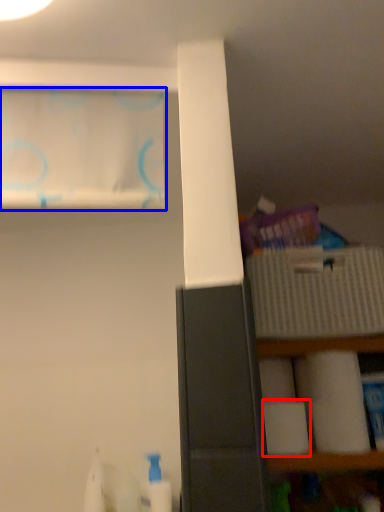
Question: Which object is further to the camera taking this photo, toilet paper (highlighted by a red box) or curtain (highlighted by a blue box)?

Choices:
 (A) toilet paper
 (B) curtain

Answer: (A)